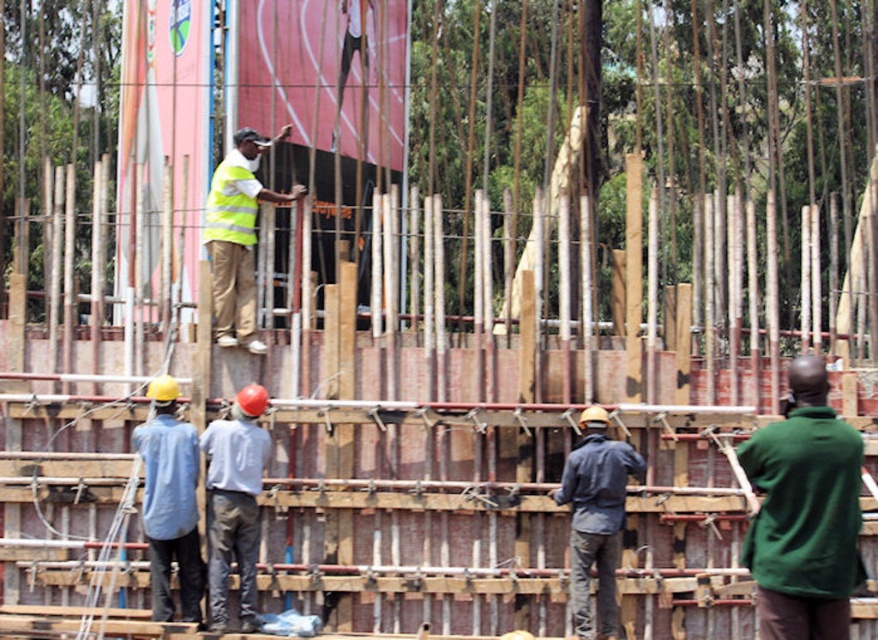
Question: Estimate the real-world distances between objects in this image. Which object is farther from the green fleece jacket at lower right?

Choices:
 (A) high-visibility reflective vest at center
 (B) dark blue denim jacket at center
 (C) light blue shirt at center
 (D) yellow reflective safety vest at center

Answer: (D)

Question: Does light blue shirt at lower left come behind yellow reflective safety vest at center?

Choices:
 (A) yes
 (B) no

Answer: (B)

Question: Is dark blue denim jacket at center to the left of yellow reflective safety vest at center from the viewer's perspective?

Choices:
 (A) yes
 (B) no

Answer: (B)

Question: Which object appears closest to the camera in this image?

Choices:
 (A) dark blue denim jacket at center
 (B) light blue shirt at lower left
 (C) green fleece jacket at lower right
 (D) light blue shirt at center

Answer: (C)

Question: Is green fleece jacket at lower right above light blue shirt at lower left?

Choices:
 (A) yes
 (B) no

Answer: (A)

Question: Which of the following is the farthest from the observer?

Choices:
 (A) green fleece jacket at lower right
 (B) yellow reflective safety vest at center

Answer: (B)